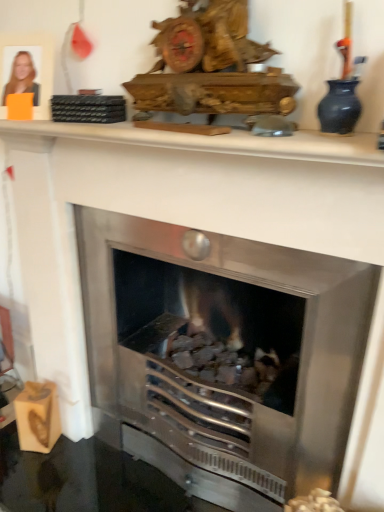
What do you see at coordinates (211, 66) in the screenshot?
I see `wooden carved clock at upper center` at bounding box center [211, 66].

This screenshot has width=384, height=512. What are the coordinates of `wooden carved clock at upper center` in the screenshot? It's located at (211, 66).

I want to click on wooden carved clock at upper center, so click(x=211, y=66).